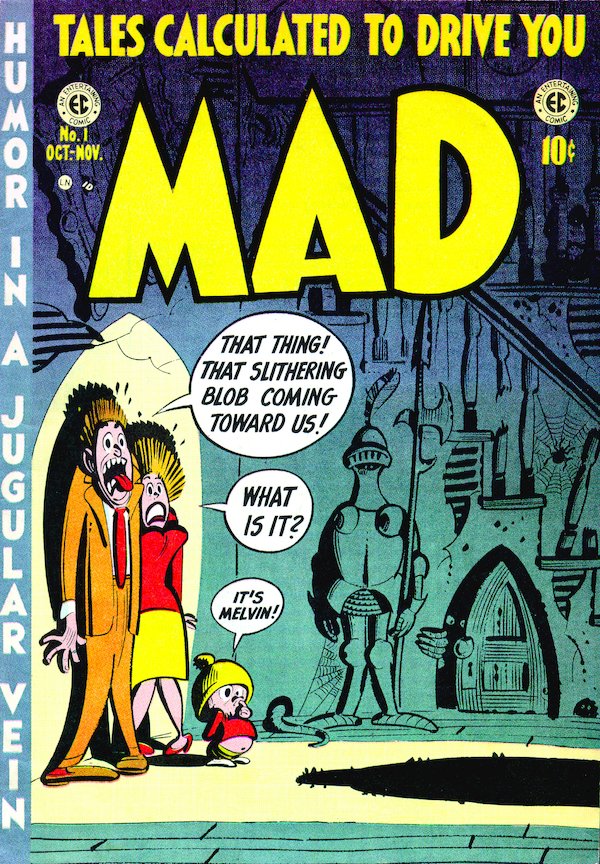
Where is `stairs`? stairs is located at coordinates (476, 446).